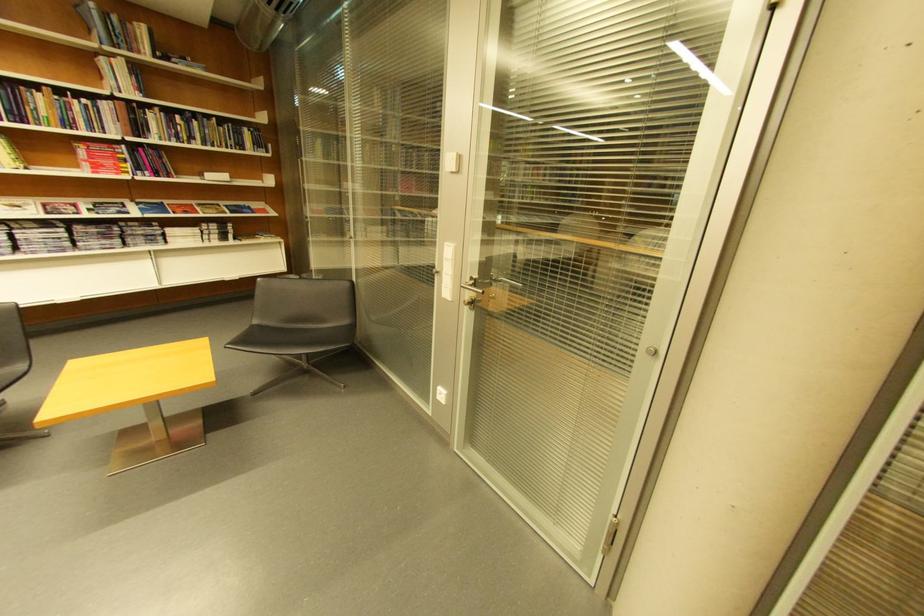
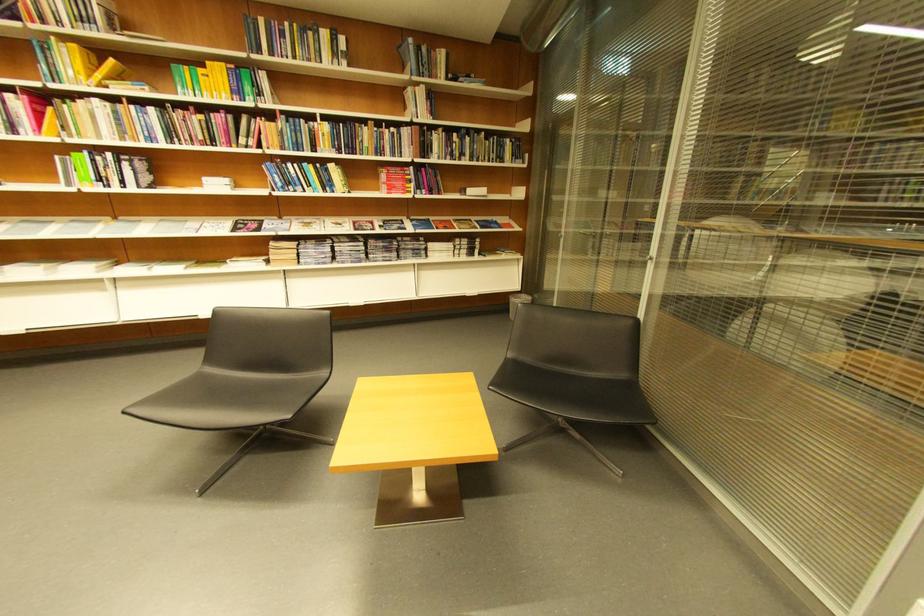
The point at (94, 103) is marked in the first image. Where is the corresponding point in the second image?

(403, 131)